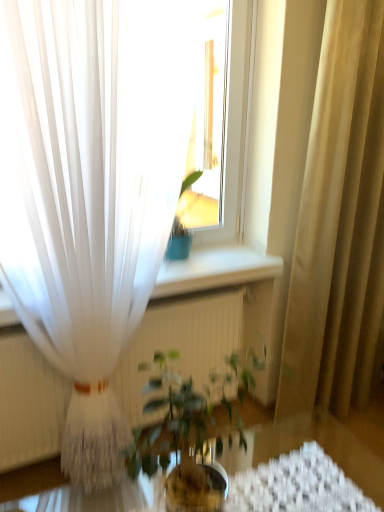
Question: Is beige fabric curtain at right, the second curtain viewed from the left, further to the viewer compared to white sheer curtain at left, which is the second curtain from right to left?

Choices:
 (A) yes
 (B) no

Answer: (A)

Question: Considering the relative sizes of beige fabric curtain at right, the second curtain viewed from the left, and white sheer curtain at left, which appears as the first curtain when viewed from the left, in the image provided, is beige fabric curtain at right, the second curtain viewed from the left, taller than white sheer curtain at left, which appears as the first curtain when viewed from the left,?

Choices:
 (A) yes
 (B) no

Answer: (A)

Question: Is beige fabric curtain at right, the second curtain viewed from the left, to the left of white sheer curtain at left, which is the second curtain from right to left, from the viewer's perspective?

Choices:
 (A) yes
 (B) no

Answer: (B)

Question: Considering the relative positions of beige fabric curtain at right, which is the 1th curtain in right-to-left order, and white sheer curtain at left, which appears as the first curtain when viewed from the left, in the image provided, is beige fabric curtain at right, which is the 1th curtain in right-to-left order, in front of white sheer curtain at left, which appears as the first curtain when viewed from the left,?

Choices:
 (A) yes
 (B) no

Answer: (B)

Question: Is white sheer curtain at left, which is the second curtain from right to left, a part of beige fabric curtain at right, the second curtain viewed from the left?

Choices:
 (A) no
 (B) yes

Answer: (A)

Question: Looking at their shapes, would you say transparent glass table at center is wider or thinner than green leafy plant at center?

Choices:
 (A) thin
 (B) wide

Answer: (B)

Question: From a real-world perspective, is transparent glass table at center positioned above or below green leafy plant at center?

Choices:
 (A) above
 (B) below

Answer: (B)

Question: From the image's perspective, relative to green leafy plant at center, is transparent glass table at center above or below?

Choices:
 (A) above
 (B) below

Answer: (B)

Question: Is transparent glass table at center spatially inside green leafy plant at center, or outside of it?

Choices:
 (A) inside
 (B) outside

Answer: (B)

Question: From a real-world perspective, is beige fabric curtain at right, which is the 1th curtain in right-to-left order, above or below transparent glass table at center?

Choices:
 (A) below
 (B) above

Answer: (B)

Question: Is beige fabric curtain at right, the second curtain viewed from the left, inside the boundaries of transparent glass table at center, or outside?

Choices:
 (A) inside
 (B) outside

Answer: (B)

Question: Is beige fabric curtain at right, the second curtain viewed from the left, in front of or behind transparent glass table at center in the image?

Choices:
 (A) behind
 (B) front

Answer: (A)

Question: Is beige fabric curtain at right, which is the 1th curtain in right-to-left order, taller or shorter than transparent glass table at center?

Choices:
 (A) short
 (B) tall

Answer: (B)

Question: Does point (140, 434) appear closer or farther from the camera than point (304, 413)?

Choices:
 (A) farther
 (B) closer

Answer: (B)

Question: In terms of height, does green leafy plant at center look taller or shorter compared to transparent glass table at center?

Choices:
 (A) tall
 (B) short

Answer: (B)